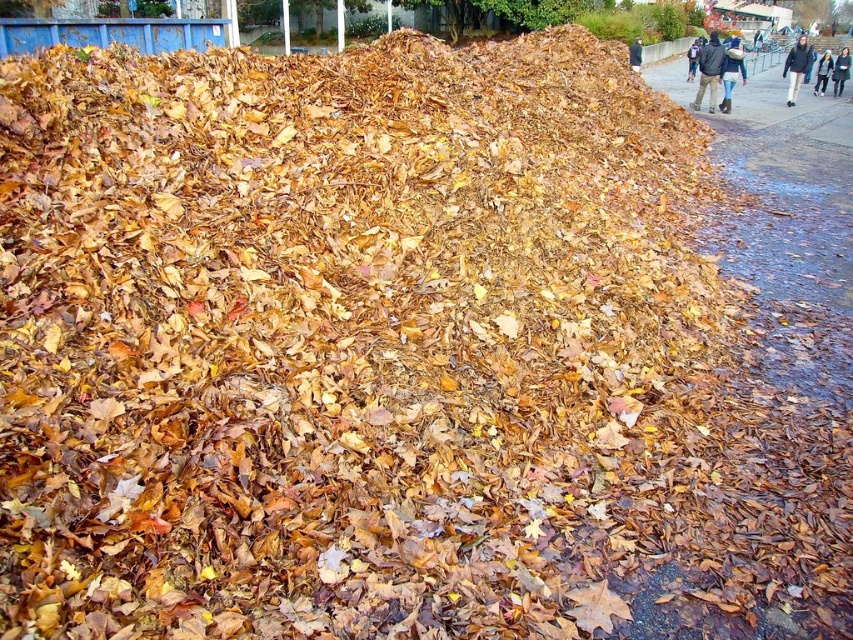
At what (x,y) coordinates should I click in order to perform the action: click on dark blue jacket at upper right. Please return your answer as a coordinate pair (x, y). The height and width of the screenshot is (640, 853). Looking at the image, I should click on (709, 70).

Based on the photo, how much distance is there between dark blue jacket at upper right and dark gray sweater at upper right?

The distance of dark blue jacket at upper right from dark gray sweater at upper right is 19.63 feet.

The width and height of the screenshot is (853, 640). Identify the location of dark blue jacket at upper right. (709, 70).

Does dark gray sweater at upper right have a smaller size compared to light blue denim jacket at lower right?

Actually, dark gray sweater at upper right might be larger than light blue denim jacket at lower right.

Between point (849, 61) and point (822, 92), which one is positioned behind?

Point (822, 92)

You are a GUI agent. You are given a task and a screenshot of the screen. Output one action in this format:
    pyautogui.click(x=<x>, y=<y>)
    Task: Click on the dark gray sweater at upper right
    
    Given the screenshot: What is the action you would take?
    pyautogui.click(x=840, y=70)

Which is in front, point (741, 72) or point (640, 60)?

Positioned in front is point (741, 72).

Is point (728, 99) in front of point (640, 38)?

Yes, point (728, 99) is closer to viewer.

Locate an element on the screen. The width and height of the screenshot is (853, 640). blue denim jeans at right is located at coordinates (730, 72).

The width and height of the screenshot is (853, 640). I want to click on blue denim jeans at right, so click(x=730, y=72).